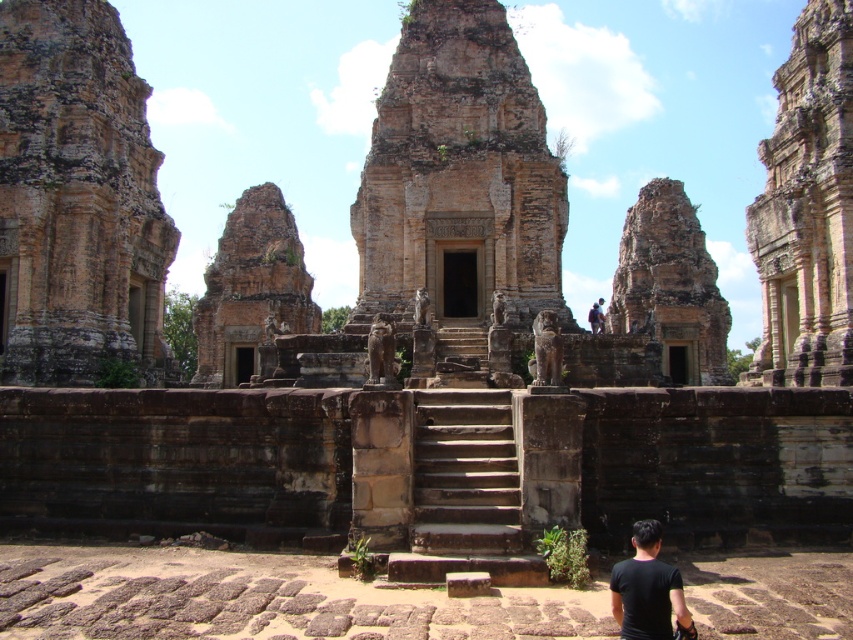
Question: Does rustic stone tower at right have a greater width compared to rusty stone ruin at center?

Choices:
 (A) no
 (B) yes

Answer: (A)

Question: Can you confirm if rustic stone tower at left is positioned below black matte shirt at lower right?

Choices:
 (A) no
 (B) yes

Answer: (A)

Question: Does rustic stone tower at left appear under rustic stone tower at right?

Choices:
 (A) yes
 (B) no

Answer: (A)

Question: Which point is closer to the camera?

Choices:
 (A) (811, 355)
 (B) (202, 344)
 (C) (99, 113)
 (D) (482, 504)

Answer: (D)

Question: Among these points, which one is nearest to the camera?

Choices:
 (A) (73, 61)
 (B) (817, 156)
 (C) (459, 548)

Answer: (C)

Question: Considering the real-world distances, which object is closest to the black matte shirt at lower right?

Choices:
 (A) rustic stone tower at right
 (B) brown stone stairs at center

Answer: (B)